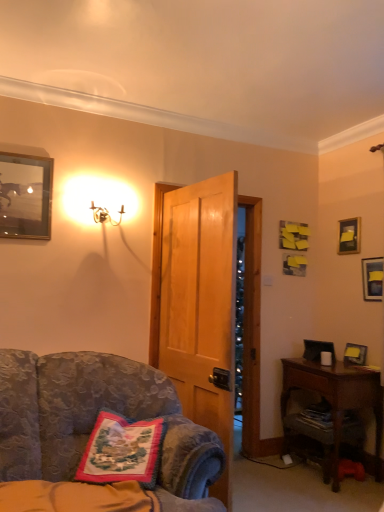
What do you see at coordinates (326, 358) in the screenshot?
I see `white matte coffee cup at right` at bounding box center [326, 358].

This screenshot has height=512, width=384. What do you see at coordinates (372, 278) in the screenshot?
I see `matte black picture frame at upper right, which is counted as the third picture frame, starting from the back` at bounding box center [372, 278].

Measure the distance between embroidered fabric pillow at lower left and camera.

6.16 feet.

The image size is (384, 512). I want to click on gold metallic sconce at upper left, so click(x=99, y=200).

The width and height of the screenshot is (384, 512). What do you see at coordinates (349, 236) in the screenshot?
I see `matte black picture frame at upper right, which is the 2th picture frame from right to left` at bounding box center [349, 236].

Describe the element at coordinates (337, 397) in the screenshot. I see `brown wooden desk at lower right` at that location.

Where is `white matte coffee cup at right`? Image resolution: width=384 pixels, height=512 pixels. white matte coffee cup at right is located at coordinates (326, 358).

Between matte black picture frame at upper right, which is counted as the fourth picture frame, starting from the left, and white matte coffee cup at right, which one has smaller width?

matte black picture frame at upper right, which is counted as the fourth picture frame, starting from the left, is thinner.

From a real-world perspective, is matte black picture frame at upper right, the second picture frame when ordered from bottom to top, located beneath white matte coffee cup at right?

Incorrect, from a real-world perspective, matte black picture frame at upper right, the second picture frame when ordered from bottom to top, is higher than white matte coffee cup at right.

What's the angular difference between matte black picture frame at upper right, which is counted as the fourth picture frame, starting from the left, and white matte coffee cup at right's facing directions?

The facing directions of matte black picture frame at upper right, which is counted as the fourth picture frame, starting from the left, and white matte coffee cup at right are 3.16 degrees apart.

Is matte black picture frame at upper right, acting as the second picture frame starting from the front, surrounding white matte coffee cup at right?

Definitely not — white matte coffee cup at right is not inside matte black picture frame at upper right, acting as the second picture frame starting from the front.

Is matte black picture frame at upper right, marked as the 2th picture frame in a top-to-bottom arrangement, inside or outside of wooden picture frame at right, which is counted as the 3th picture frame, starting from the right?

matte black picture frame at upper right, marked as the 2th picture frame in a top-to-bottom arrangement, is not enclosed by wooden picture frame at right, which is counted as the 3th picture frame, starting from the right.

Is matte black picture frame at upper right, which is the 2th picture frame from right to left, positioned with its back to wooden picture frame at right, positioned as the second picture frame in back-to-front order?

No, wooden picture frame at right, positioned as the second picture frame in back-to-front order, is not at the back of matte black picture frame at upper right, which is the 2th picture frame from right to left.

Does matte black picture frame at upper right, positioned as the 1th picture frame in back-to-front order, touch wooden picture frame at right, the third picture frame in the front-to-back sequence?

No, matte black picture frame at upper right, positioned as the 1th picture frame in back-to-front order, is not beside wooden picture frame at right, the third picture frame in the front-to-back sequence.

Is matte black picture frame at upper right, marked as the 2th picture frame in a top-to-bottom arrangement, at the right side of wooden picture frame at right, which is counted as the 3th picture frame, starting from the right?

Yes, matte black picture frame at upper right, marked as the 2th picture frame in a top-to-bottom arrangement, is to the right of wooden picture frame at right, which is counted as the 3th picture frame, starting from the right.

Is white matte coffee cup at right oriented away from velvet floral-patterned chair at center-left?

No, white matte coffee cup at right's orientation is not away from velvet floral-patterned chair at center-left.

Considering the positions of objects white matte coffee cup at right and velvet floral-patterned chair at center-left in the image provided, who is in front, white matte coffee cup at right or velvet floral-patterned chair at center-left?

velvet floral-patterned chair at center-left is closer to the camera.

Which is more to the right, white matte coffee cup at right or velvet floral-patterned chair at center-left?

white matte coffee cup at right.

Choose the correct answer: Is white matte coffee cup at right inside velvet floral-patterned chair at center-left or outside it?

white matte coffee cup at right is located beyond the bounds of velvet floral-patterned chair at center-left.

Is matte black picture frame at upper right, arranged as the third picture frame when viewed from the top, behind brown wooden desk at lower right?

Yes, it is behind brown wooden desk at lower right.

From a real-world perspective, is matte black picture frame at upper right, arranged as the third picture frame when viewed from the top, located beneath brown wooden desk at lower right?

Actually, matte black picture frame at upper right, arranged as the third picture frame when viewed from the top, is physically above brown wooden desk at lower right in the real world.

From the image's perspective, would you say matte black picture frame at upper right, which is counted as the fourth picture frame, starting from the left, is positioned over brown wooden desk at lower right?

Yes, from the image's perspective, matte black picture frame at upper right, which is counted as the fourth picture frame, starting from the left, is over brown wooden desk at lower right.

How different are the orientations of matte black picture frame at upper right, the first picture frame from the right, and brown wooden desk at lower right in degrees?

The facing directions of matte black picture frame at upper right, the first picture frame from the right, and brown wooden desk at lower right are 1.42 degrees apart.

Do you think embroidered fabric pillow at lower left is within velvet floral-patterned chair at center-left, or outside of it?

The correct answer is: inside.

From the image's perspective, is embroidered fabric pillow at lower left above velvet floral-patterned chair at center-left?

Yes, from the image's perspective, embroidered fabric pillow at lower left is on top of velvet floral-patterned chair at center-left.

Is embroidered fabric pillow at lower left oriented towards velvet floral-patterned chair at center-left?

Yes, embroidered fabric pillow at lower left is turned towards velvet floral-patterned chair at center-left.

From a real-world perspective, is embroidered fabric pillow at lower left over velvet floral-patterned chair at center-left?

Correct, in the physical world, embroidered fabric pillow at lower left is higher than velvet floral-patterned chair at center-left.

Is embroidered fabric pillow at lower left positioned far away from gold metallic sconce at upper left?

Indeed, embroidered fabric pillow at lower left is not near gold metallic sconce at upper left.

Considering the relative sizes of embroidered fabric pillow at lower left and gold metallic sconce at upper left in the image provided, is embroidered fabric pillow at lower left taller than gold metallic sconce at upper left?

Indeed, embroidered fabric pillow at lower left has a greater height compared to gold metallic sconce at upper left.

Would you say embroidered fabric pillow at lower left is inside or outside gold metallic sconce at upper left?

embroidered fabric pillow at lower left is located beyond the bounds of gold metallic sconce at upper left.

Where is `chair beneath the gold metallic sconce at upper left (from a real-world perspective)`? The width and height of the screenshot is (384, 512). chair beneath the gold metallic sconce at upper left (from a real-world perspective) is located at coordinates (95, 421).

Is point (116, 197) behind point (174, 394)?

That is True.

Find the location of a particular element. The width and height of the screenshot is (384, 512). the 3rd picture frame counting from the right side of the white matte coffee cup at right is located at coordinates (372, 278).

Identify the location of picture frame that is the 1st object located in front of the matte black picture frame at upper right, positioned as the 1th picture frame in back-to-front order. (355, 354).

Looking at the image, which one is located further to metallic silver picture frame at upper left, the 4th picture frame positioned from the right, white matte coffee cup at right or matte black picture frame at upper right, the fourth picture frame positioned from the front?

matte black picture frame at upper right, the fourth picture frame positioned from the front, is positioned further to the anchor metallic silver picture frame at upper left, the 4th picture frame positioned from the right.

When comparing their distances from wooden picture frame at right, the third picture frame in the front-to-back sequence, does matte black picture frame at upper right, the fourth picture frame positioned from the front, or matte black picture frame at upper right, arranged as the third picture frame when viewed from the top, seem closer?

matte black picture frame at upper right, arranged as the third picture frame when viewed from the top, lies closer to wooden picture frame at right, the third picture frame in the front-to-back sequence, than the other object.

From the image, which object appears to be farther from velvet floral-patterned chair at center-left, brown wooden desk at lower right or matte black picture frame at upper right, positioned as the third picture frame in left-to-right order?

Among the two, matte black picture frame at upper right, positioned as the third picture frame in left-to-right order, is located further to velvet floral-patterned chair at center-left.

When comparing their distances from white matte coffee cup at right, does wooden picture frame at right, which is counted as the 3th picture frame, starting from the right, or brown wooden desk at lower right seem closer?

wooden picture frame at right, which is counted as the 3th picture frame, starting from the right.

Estimate the real-world distances between objects in this image. Which object is closer to gold metallic sconce at upper left, metallic silver picture frame at upper left, the 4th picture frame positioned from the right, or brown wooden desk at lower right?

Based on the image, metallic silver picture frame at upper left, the 4th picture frame positioned from the right, appears to be nearer to gold metallic sconce at upper left.

From the image, which object appears to be nearer to embroidered fabric pillow at lower left, velvet floral-patterned chair at center-left or brown wooden desk at lower right?

velvet floral-patterned chair at center-left is closer to embroidered fabric pillow at lower left.

Which object lies nearer to the anchor point metallic silver picture frame at upper left, which ranks as the first picture frame in left-to-right order, gold metallic sconce at upper left or embroidered fabric pillow at lower left?

Based on the image, gold metallic sconce at upper left appears to be nearer to metallic silver picture frame at upper left, which ranks as the first picture frame in left-to-right order.

Based on their spatial positions, is white matte coffee cup at right or brown wooden desk at lower right closer to velvet floral-patterned chair at center-left?

brown wooden desk at lower right.

Locate an element on the screen. The image size is (384, 512). pillow located between velvet floral-patterned chair at center-left and wooden picture frame at right, the 4th picture frame from the top, in the depth direction is located at coordinates (122, 450).

The width and height of the screenshot is (384, 512). In order to click on desk between gold metallic sconce at upper left and matte black picture frame at upper right, positioned as the third picture frame in left-to-right order, in the horizontal direction in this screenshot , I will do `click(337, 397)`.

Locate an element on the screen. This screenshot has height=512, width=384. chair located between gold metallic sconce at upper left and matte black picture frame at upper right, which is counted as the fourth picture frame, starting from the left, in the left-right direction is located at coordinates (95, 421).

Find the location of `desk between metallic silver picture frame at upper left, the 4th picture frame positioned from the right, and wooden picture frame at right, acting as the second picture frame starting from the left, in the horizontal direction`. desk between metallic silver picture frame at upper left, the 4th picture frame positioned from the right, and wooden picture frame at right, acting as the second picture frame starting from the left, in the horizontal direction is located at coordinates (337, 397).